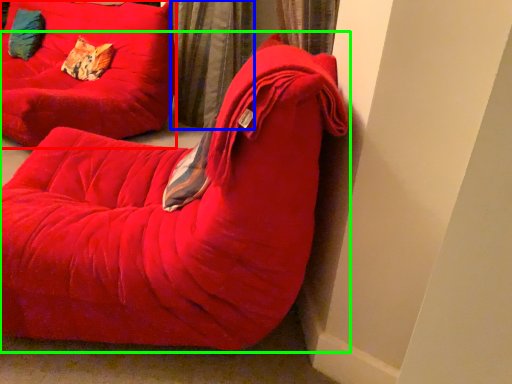
Question: Which is farther away from furniture (highlighted by a red box)? curtain (highlighted by a blue box) or furniture (highlighted by a green box)?

Choices:
 (A) curtain
 (B) furniture

Answer: (B)